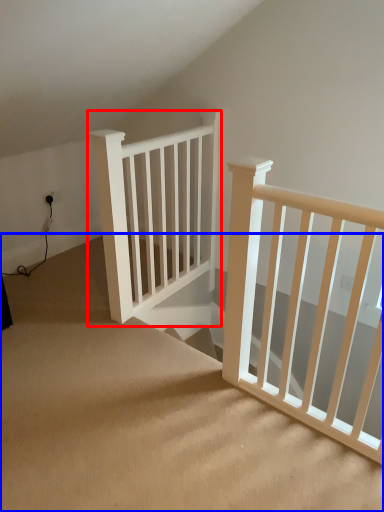
Question: Which object appears closest to the camera in this image, rail (highlighted by a red box) or stairs (highlighted by a blue box)?

Choices:
 (A) rail
 (B) stairs

Answer: (B)